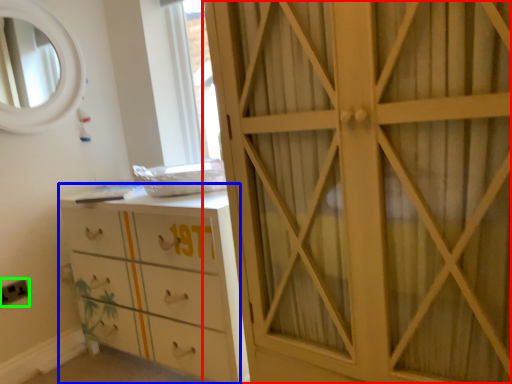
Question: Which is nearer to the cupboard (highlighted by a red box)? chest of drawers (highlighted by a blue box) or electric outlet (highlighted by a green box).

Choices:
 (A) chest of drawers
 (B) electric outlet

Answer: (A)